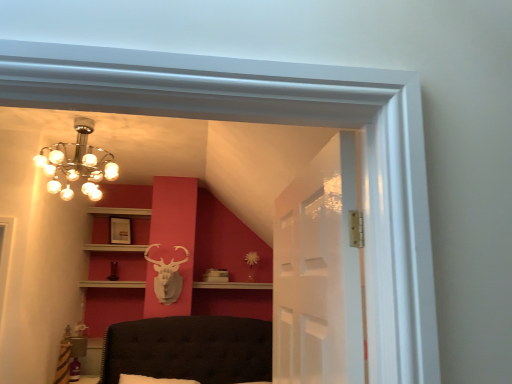
Question: In terms of size, does matte white picture frame at upper center appear bigger or smaller than white wood shelf at upper center?

Choices:
 (A) big
 (B) small

Answer: (B)

Question: Looking at their shapes, would you say matte white picture frame at upper center is wider or thinner than white wood shelf at upper center?

Choices:
 (A) wide
 (B) thin

Answer: (B)

Question: Which object is positioned closest to the matte white picture frame at upper center?

Choices:
 (A) transparent glass door at center
 (B) chrome/metallic chandelier at upper left
 (C) white wood shelf at upper center
 (D) white matte deer head at center

Answer: (C)

Question: Which object is positioned closest to the transparent glass door at center?

Choices:
 (A) matte white picture frame at upper center
 (B) white wood shelf at upper center
 (C) chrome/metallic chandelier at upper left
 (D) white matte deer head at center

Answer: (C)